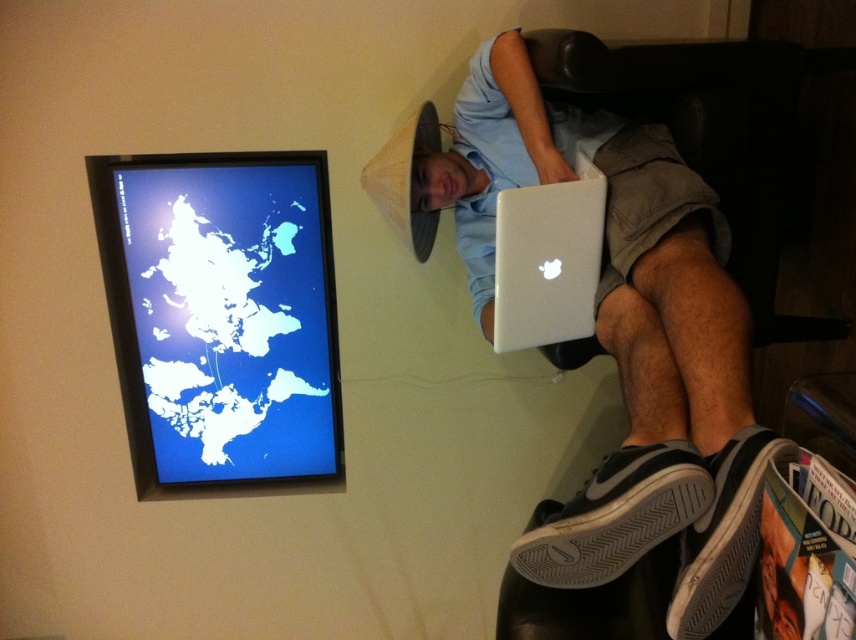
Does point (652, 314) come closer to viewer compared to point (706, 525)?

That is False.

Measure the distance between silver metallic laptop at upper center and camera.

They are 1.03 meters apart.

I want to click on silver metallic laptop at upper center, so click(625, 339).

Is point (123, 275) less distant than point (516, 547)?

No, (123, 275) is behind (516, 547).

Is blue glossy map at upper left to the left of black mesh shoe at lower right from the viewer's perspective?

Correct, you'll find blue glossy map at upper left to the left of black mesh shoe at lower right.

Is point (241, 296) farther from viewer compared to point (514, 566)?

Yes, it is.

This screenshot has width=856, height=640. In order to click on blue glossy map at upper left in this screenshot , I will do `click(223, 317)`.

Can you confirm if silver metallic laptop at center is wider than white rubber shoe at lower right?

Correct, the width of silver metallic laptop at center exceeds that of white rubber shoe at lower right.

Which is above, silver metallic laptop at center or white rubber shoe at lower right?

silver metallic laptop at center is above.

Is point (597, 173) positioned in front of point (732, 436)?

No, (597, 173) is further to viewer.

The image size is (856, 640). Find the location of `silver metallic laptop at center`. silver metallic laptop at center is located at coordinates tap(548, 260).